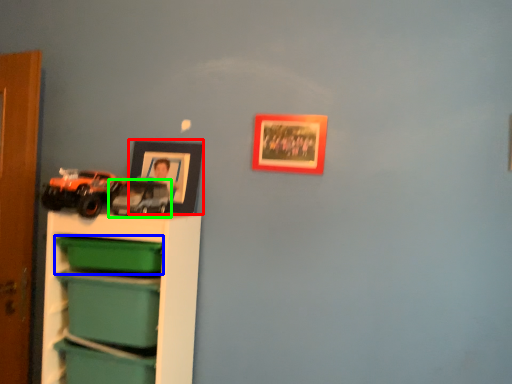
Question: Which object is the farthest from picture frame (highlighted by a red box)? Choose among these: storage box (highlighted by a blue box) or toy (highlighted by a green box).

Choices:
 (A) storage box
 (B) toy

Answer: (A)